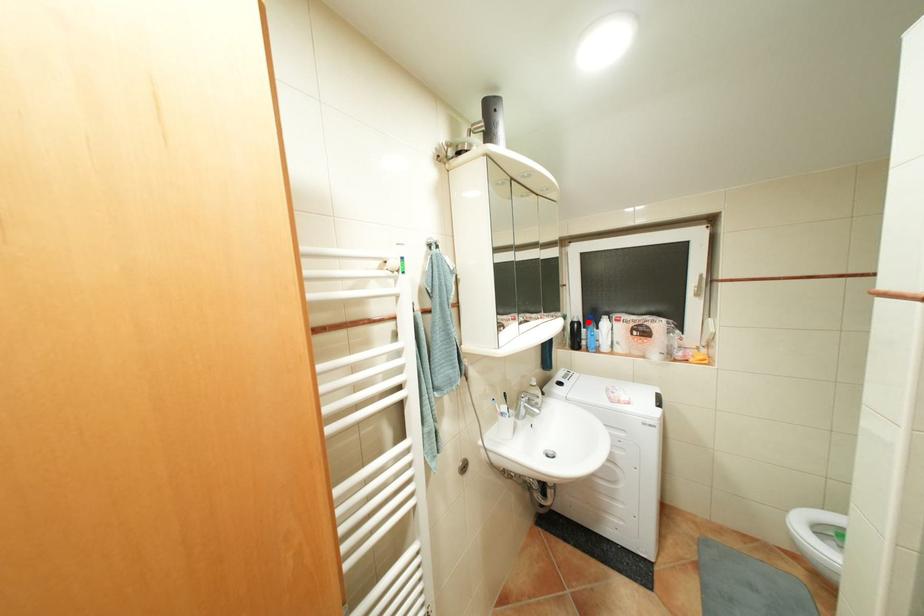
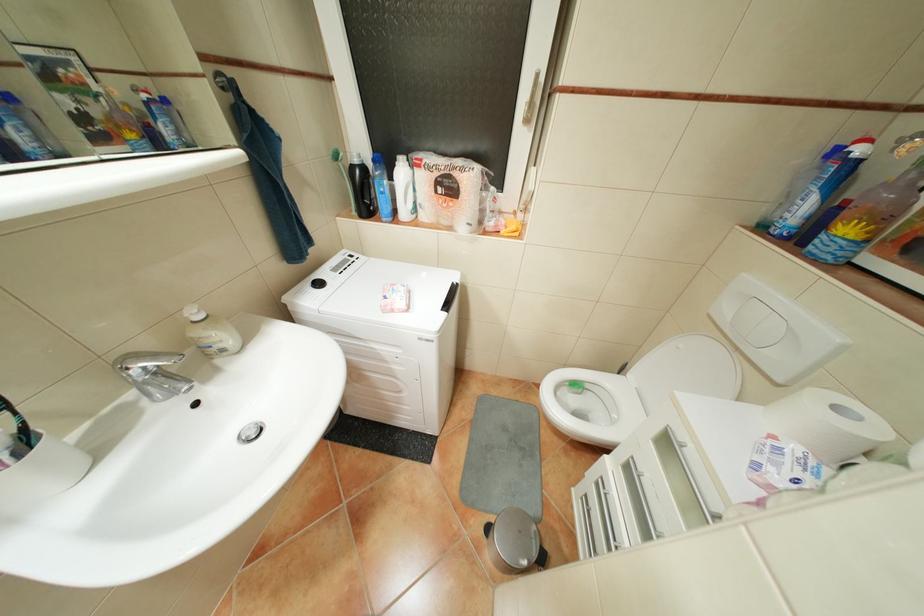
Question: I am providing you with two images of the same scene from different viewpoints. In image1, a red point is highlighted. Considering the same 3D point in image2, which of the following is correct?

Choices:
 (A) It is closer
 (B) It is farther

Answer: (A)